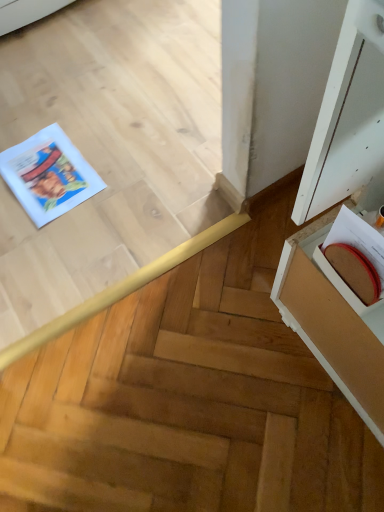
The width and height of the screenshot is (384, 512). In order to click on vacant space situated above white paper comic book at left (from a real-world perspective) in this screenshot , I will do `click(49, 172)`.